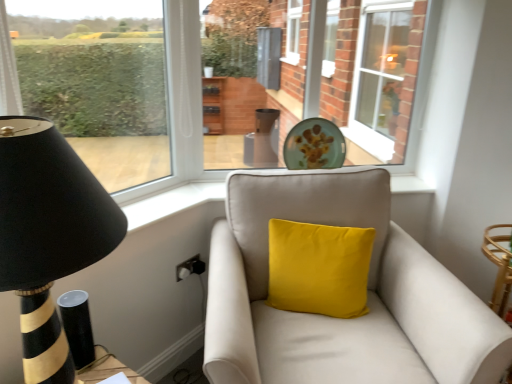
This screenshot has width=512, height=384. I want to click on black striped wood table lamp at left, so click(x=48, y=234).

Image resolution: width=512 pixels, height=384 pixels. Describe the element at coordinates (314, 145) in the screenshot. I see `matte glass plate at center` at that location.

Locate an element on the screen. matte glass plate at center is located at coordinates (314, 145).

You are a GUI agent. You are given a task and a screenshot of the screen. Output one action in this format:
    pyautogui.click(x=<x>, y=<y>)
    Task: Click on the suede beige couch at center
    This screenshot has width=512, height=384.
    Given the screenshot: What is the action you would take?
    pyautogui.click(x=335, y=318)

Which is more distant, (309, 145) or (271, 253)?

Point (309, 145)

From a real-world perspective, is matte glass plate at center over yellow velvet cushion at center?

Yes, from a real-world perspective, matte glass plate at center is above yellow velvet cushion at center.

What's the angular difference between matte glass plate at center and yellow velvet cushion at center's facing directions?

The angle between the facing direction of matte glass plate at center and the facing direction of yellow velvet cushion at center is 22 degrees.

Is matte glass plate at center beside yellow velvet cushion at center?

No, matte glass plate at center is not beside yellow velvet cushion at center.

From the image's perspective, who appears lower, yellow velvet cushion at center or matte glass plate at center?

yellow velvet cushion at center, from the image's perspective.

From a real-world perspective, between yellow velvet cushion at center and matte glass plate at center, who is vertically lower?

yellow velvet cushion at center is physically lower.

Between point (315, 297) and point (320, 140), which one is positioned in front?

The point (315, 297) is closer to the camera.

Which of these two, clear glass window at upper right, which ranks as the second window in front-to-back order, or transparent glass window at left, marked as the second window in a right-to-left arrangement, stands taller?

clear glass window at upper right, which ranks as the second window in front-to-back order, is taller.

From the image's perspective, does clear glass window at upper right, which appears as the first window when viewed from the right, appear lower than transparent glass window at left, the first window from the front?

Incorrect, from the image's perspective, clear glass window at upper right, which appears as the first window when viewed from the right, is higher than transparent glass window at left, the first window from the front.

Does clear glass window at upper right, which appears as the first window when viewed from the right, come behind transparent glass window at left, the first window from the front?

Yes, clear glass window at upper right, which appears as the first window when viewed from the right, is further from the camera.

Is clear glass window at upper right, which appears as the first window when viewed from the right, facing away from transparent glass window at left, placed as the 2th window when sorted from back to front?

clear glass window at upper right, which appears as the first window when viewed from the right, is not turned away from transparent glass window at left, placed as the 2th window when sorted from back to front.

Is point (4, 46) closer or farther from the camera than point (396, 57)?

Point (4, 46) is positioned closer to the camera compared to point (396, 57).

From the image's perspective, is transparent glass window at left, marked as the second window in a right-to-left arrangement, below clear glass window at upper right, which ranks as the second window in front-to-back order?

Yes, from the image's perspective, transparent glass window at left, marked as the second window in a right-to-left arrangement, is beneath clear glass window at upper right, which ranks as the second window in front-to-back order.

Is transparent glass window at left, the first window from the front, wider than clear glass window at upper right, which appears as the first window when viewed from the right?

Incorrect, the width of transparent glass window at left, the first window from the front, does not surpass that of clear glass window at upper right, which appears as the first window when viewed from the right.

Is transparent glass window at left, which ranks as the 1th window in left-to-right order, bigger than clear glass window at upper right, which is the 1th window in back-to-front order?

Actually, transparent glass window at left, which ranks as the 1th window in left-to-right order, might be smaller than clear glass window at upper right, which is the 1th window in back-to-front order.

Is suede beige couch at center spatially inside transparent glass window at left, which ranks as the 1th window in left-to-right order, or outside of it?

suede beige couch at center is located beyond the bounds of transparent glass window at left, which ranks as the 1th window in left-to-right order.

Is suede beige couch at center wider or thinner than transparent glass window at left, the first window from the front?

Clearly, suede beige couch at center has more width compared to transparent glass window at left, the first window from the front.

Considering the relative sizes of suede beige couch at center and transparent glass window at left, marked as the second window in a right-to-left arrangement, in the image provided, is suede beige couch at center bigger than transparent glass window at left, marked as the second window in a right-to-left arrangement,?

Yes, suede beige couch at center is bigger than transparent glass window at left, marked as the second window in a right-to-left arrangement.

Locate an element on the screen. the 1st window positioned above the suede beige couch at center (from the image's perspective) is located at coordinates (179, 101).

From the image's perspective, which object appears higher, black striped wood table lamp at left or yellow velvet cushion at center?

black striped wood table lamp at left appears higher in the image.

Locate an element on the screen. pillow below the black striped wood table lamp at left (from the image's perspective) is located at coordinates (319, 268).

Is yellow velvet cushion at center located within black striped wood table lamp at left?

No, yellow velvet cushion at center is not a part of black striped wood table lamp at left.

Considering the relative sizes of yellow velvet cushion at center and transparent glass window at left, which ranks as the 1th window in left-to-right order, in the image provided, is yellow velvet cushion at center shorter than transparent glass window at left, which ranks as the 1th window in left-to-right order,?

Yes, yellow velvet cushion at center is shorter than transparent glass window at left, which ranks as the 1th window in left-to-right order.

Is yellow velvet cushion at center far away from transparent glass window at left, marked as the second window in a right-to-left arrangement?

Actually, yellow velvet cushion at center and transparent glass window at left, marked as the second window in a right-to-left arrangement, are a little close together.

Consider the image. Which point is more distant from viewer, (294,306) or (186,71)?

Point (186,71)

From the image's perspective, who appears lower, yellow velvet cushion at center or transparent glass window at left, the first window from the front?

yellow velvet cushion at center appears lower in the image.

Locate an element on the screen. The width and height of the screenshot is (512, 384). plate located behind the yellow velvet cushion at center is located at coordinates (314, 145).

Find the location of a particular element. pillow lying below the matte glass plate at center (from the image's perspective) is located at coordinates (319, 268).

Estimate the real-world distances between objects in this image. Which object is closer to suede beige couch at center, clear glass window at upper right, the second window positioned from the left, or yellow velvet cushion at center?

Among the two, yellow velvet cushion at center is located nearer to suede beige couch at center.

From the image, which object appears to be nearer to suede beige couch at center, black striped wood table lamp at left or clear glass window at upper right, which appears as the first window when viewed from the right?

The object closer to suede beige couch at center is black striped wood table lamp at left.

Estimate the real-world distances between objects in this image. Which object is further from transparent glass window at left, marked as the second window in a right-to-left arrangement, clear glass window at upper right, which ranks as the second window in front-to-back order, or black striped wood table lamp at left?

clear glass window at upper right, which ranks as the second window in front-to-back order.

Looking at the image, which one is located further to black striped wood table lamp at left, matte glass plate at center or yellow velvet cushion at center?

Among the two, matte glass plate at center is located further to black striped wood table lamp at left.

Looking at the image, which one is located closer to transparent glass window at left, placed as the 2th window when sorted from back to front, clear glass window at upper right, the second window positioned from the left, or yellow velvet cushion at center?

Based on the image, yellow velvet cushion at center appears to be nearer to transparent glass window at left, placed as the 2th window when sorted from back to front.

Based on the photo, which object lies nearer to the anchor point matte glass plate at center, transparent glass window at left, which ranks as the 1th window in left-to-right order, or black striped wood table lamp at left?

The object closer to matte glass plate at center is transparent glass window at left, which ranks as the 1th window in left-to-right order.

Based on their spatial positions, is clear glass window at upper right, which ranks as the second window in front-to-back order, or matte glass plate at center closer to suede beige couch at center?

Based on the image, matte glass plate at center appears to be nearer to suede beige couch at center.

Which object lies further to the anchor point transparent glass window at left, the first window from the front, yellow velvet cushion at center or suede beige couch at center?

suede beige couch at center is positioned further to the anchor transparent glass window at left, the first window from the front.

Where is `pillow positioned between black striped wood table lamp at left and matte glass plate at center from near to far`? This screenshot has width=512, height=384. pillow positioned between black striped wood table lamp at left and matte glass plate at center from near to far is located at coordinates (319, 268).

The image size is (512, 384). In order to click on studio couch positioned between black striped wood table lamp at left and clear glass window at upper right, which is the 1th window in back-to-front order, from near to far in this screenshot , I will do `click(335, 318)`.

This screenshot has height=384, width=512. Find the location of `studio couch between black striped wood table lamp at left and yellow velvet cushion at center in the front-back direction`. studio couch between black striped wood table lamp at left and yellow velvet cushion at center in the front-back direction is located at coordinates (335, 318).

What are the coordinates of `window between suede beige couch at center and matte glass plate at center from front to back` in the screenshot? It's located at (179, 101).